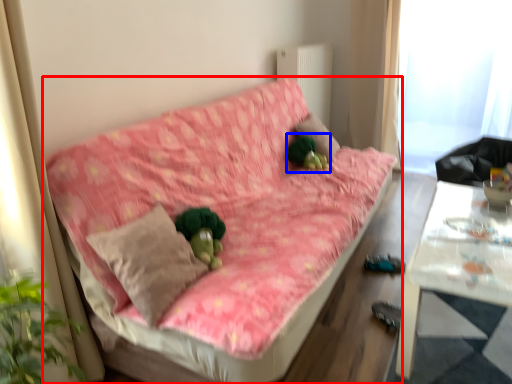
Question: Which object is further to the camera taking this photo, studio couch (highlighted by a red box) or toy (highlighted by a blue box)?

Choices:
 (A) studio couch
 (B) toy

Answer: (B)